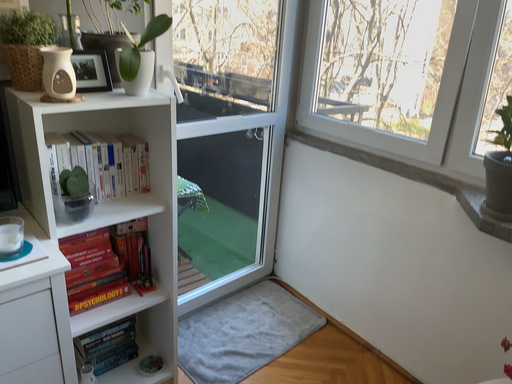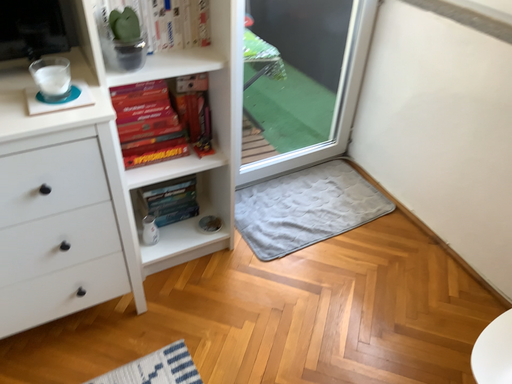
Question: How did the camera likely rotate when shooting the video?

Choices:
 (A) rotated left
 (B) rotated right

Answer: (A)